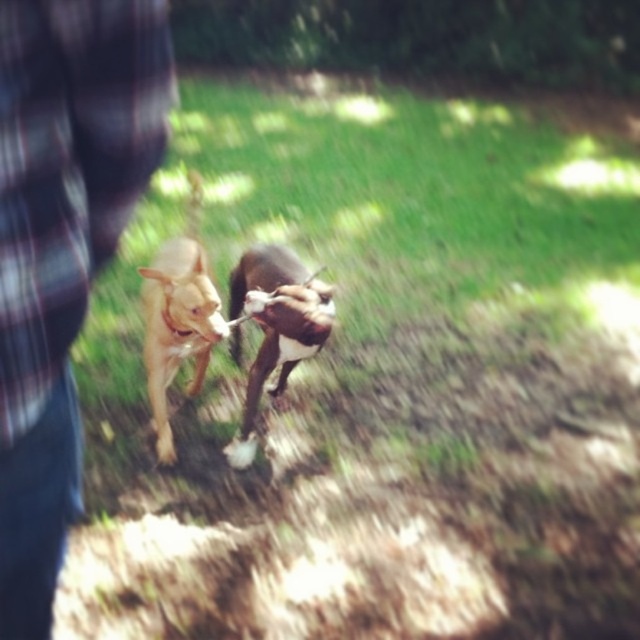
Between plaid fabric shirt at left and light brown fur dog at center, which one has more height?

With more height is light brown fur dog at center.

From the picture: Is plaid fabric shirt at left above light brown fur dog at center?

Yes, plaid fabric shirt at left is above light brown fur dog at center.

Which is in front, point (16, 544) or point (204, 326)?

Positioned in front is point (16, 544).

Find the location of a particular element. plaid fabric shirt at left is located at coordinates (61, 248).

Can you confirm if plaid fabric shirt at left is positioned to the left of brown fur dog at center?

Yes, plaid fabric shirt at left is to the left of brown fur dog at center.

Is the position of plaid fabric shirt at left more distant than that of brown fur dog at center?

No, it is in front of brown fur dog at center.

Locate an element on the screen. The width and height of the screenshot is (640, 640). plaid fabric shirt at left is located at coordinates (61, 248).

This screenshot has width=640, height=640. Find the location of `plaid fabric shirt at left`. plaid fabric shirt at left is located at coordinates (61, 248).

Who is positioned more to the left, light brown fur dog at center or brown fur dog at center?

Positioned to the left is light brown fur dog at center.

Does point (150, 339) come in front of point (244, 456)?

Yes, it is in front of point (244, 456).

Is point (202, 252) less distant than point (291, 330)?

No.

Locate an element on the screen. Image resolution: width=640 pixels, height=640 pixels. light brown fur dog at center is located at coordinates (179, 317).